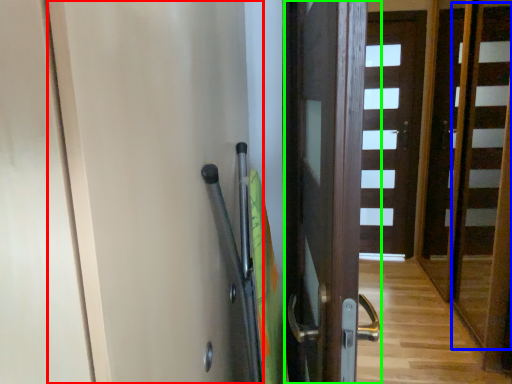
Question: Considering the real-world distances, which object is closest to screen door (highlighted by a red box)? stair (highlighted by a blue box) or door (highlighted by a green box).

Choices:
 (A) stair
 (B) door

Answer: (B)